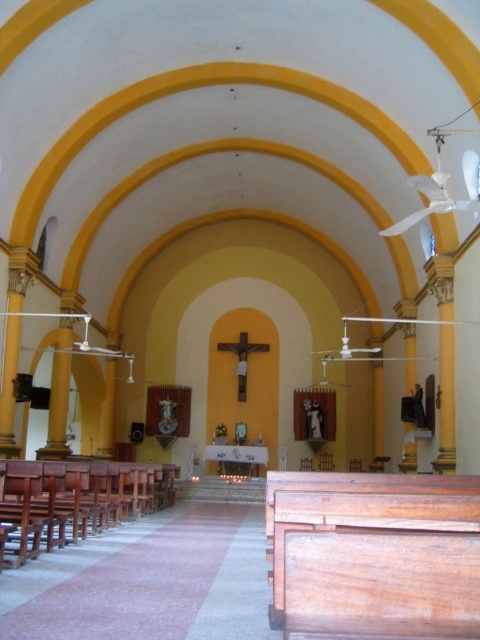
You are attending a church service and need to find a seat. You see the wooden church bench at lower right and the wooden church bench at left. Which bench is closer to the altar?

The wooden church bench at lower right is closer to the altar because it is positioned above the wooden church bench at left, which places it nearer to the altar area.